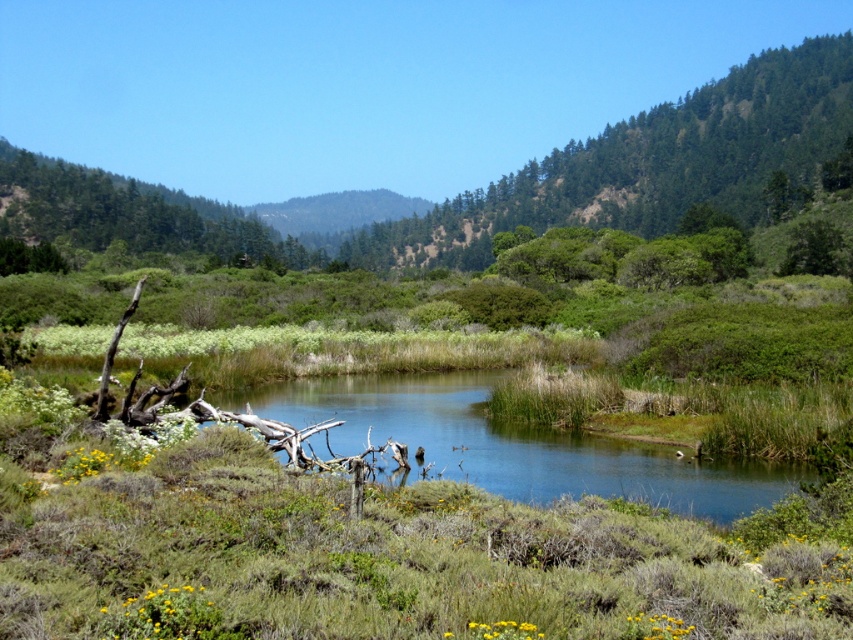
Is green leafy tree at upper center above clear water at center?

Yes.

Is point (776, 72) positioned before point (415, 424)?

That is False.

Does point (592, 160) lie behind point (453, 468)?

Yes, point (592, 160) is behind point (453, 468).

This screenshot has height=640, width=853. In order to click on green leafy tree at upper center in this screenshot , I will do `click(648, 163)`.

Is point (473, 381) farther from camera compared to point (198, 218)?

No, (473, 381) is in front of (198, 218).

Can you confirm if clear water at center is smaller than green leafy tree at upper left?

Yes.

Image resolution: width=853 pixels, height=640 pixels. I want to click on clear water at center, so click(x=514, y=444).

At what (x,y) coordinates should I click in order to perform the action: click on clear water at center. Please return your answer as a coordinate pair (x, y). The image size is (853, 640). Looking at the image, I should click on 514,444.

Does clear water at center have a smaller size compared to green leafy tree at upper right?

Indeed, clear water at center has a smaller size compared to green leafy tree at upper right.

Can you confirm if clear water at center is bigger than green leafy tree at upper right?

No, clear water at center is not bigger than green leafy tree at upper right.

Describe the element at coordinates (514, 444) in the screenshot. I see `clear water at center` at that location.

Where is `clear water at center`? clear water at center is located at coordinates (514, 444).